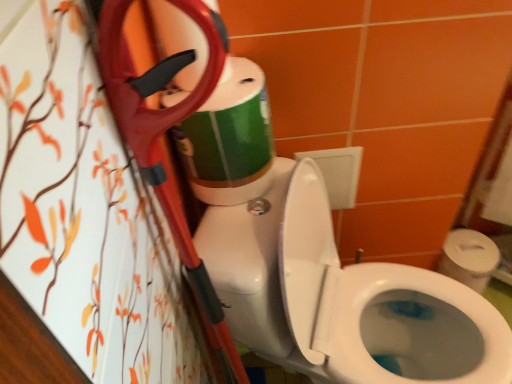
Question: From a real-world perspective, is white glossy toilet at center above or below green matte toilet paper at upper center?

Choices:
 (A) below
 (B) above

Answer: (A)

Question: Is white glossy toilet at center in front of or behind green matte toilet paper at upper center in the image?

Choices:
 (A) behind
 (B) front

Answer: (B)

Question: From the image's perspective, is white glossy toilet at center located above or below green matte toilet paper at upper center?

Choices:
 (A) above
 (B) below

Answer: (B)

Question: Considering their positions, is green matte toilet paper at upper center located in front of or behind white glossy toilet at center?

Choices:
 (A) behind
 (B) front

Answer: (A)

Question: From a real-world perspective, relative to white glossy toilet at center, is green matte toilet paper at upper center vertically above or below?

Choices:
 (A) below
 (B) above

Answer: (B)

Question: Considering the positions of green matte toilet paper at upper center and white glossy toilet at center in the image, is green matte toilet paper at upper center taller or shorter than white glossy toilet at center?

Choices:
 (A) tall
 (B) short

Answer: (B)

Question: From the image's perspective, relative to white glossy toilet at center, is green matte toilet paper at upper center above or below?

Choices:
 (A) above
 (B) below

Answer: (A)